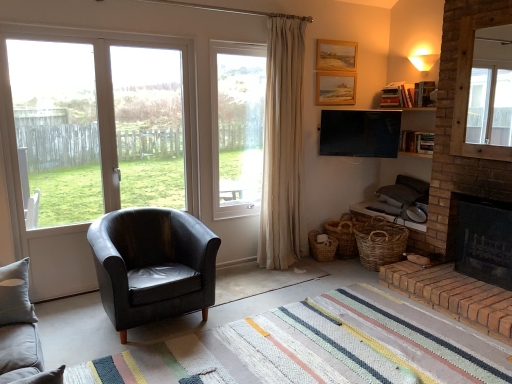
This screenshot has height=384, width=512. I want to click on blank space situated above rug at center (from a real-world perspective), so click(x=308, y=347).